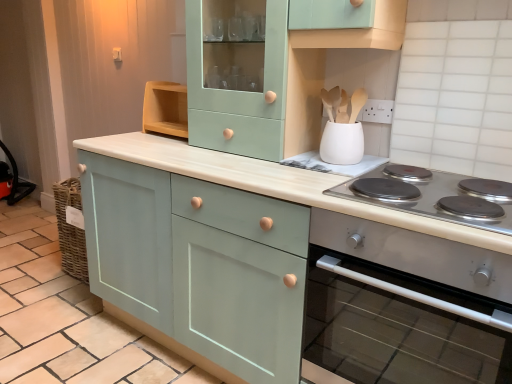
Question: Is matte teal cabinet at center, arranged as the 3th cabinetry when viewed from the right, not inside silver metallic cooktop at lower right?

Choices:
 (A) yes
 (B) no

Answer: (A)

Question: From the image's perspective, is matte teal cabinet at center, arranged as the 3th cabinetry when viewed from the right, over silver metallic cooktop at lower right?

Choices:
 (A) yes
 (B) no

Answer: (B)

Question: From a real-world perspective, is matte teal cabinet at center, arranged as the 3th cabinetry when viewed from the right, on silver metallic cooktop at lower right?

Choices:
 (A) no
 (B) yes

Answer: (A)

Question: Is matte teal cabinet at center, arranged as the 3th cabinetry when viewed from the right, bigger than silver metallic cooktop at lower right?

Choices:
 (A) no
 (B) yes

Answer: (B)

Question: Does matte teal cabinet at center, arranged as the 3th cabinetry when viewed from the right, have a smaller size compared to silver metallic cooktop at lower right?

Choices:
 (A) yes
 (B) no

Answer: (B)

Question: From a real-world perspective, is matte teal cabinet at center, arranged as the 3th cabinetry when viewed from the right, below silver metallic cooktop at lower right?

Choices:
 (A) no
 (B) yes

Answer: (B)

Question: Considering the relative sizes of mint green wood cabinet at upper center, acting as the 2th cabinetry starting from the left, and matte green cabinet at center, which is the 3th cabinetry from left to right, in the image provided, is mint green wood cabinet at upper center, acting as the 2th cabinetry starting from the left, smaller than matte green cabinet at center, which is the 3th cabinetry from left to right,?

Choices:
 (A) no
 (B) yes

Answer: (B)

Question: Is mint green wood cabinet at upper center, acting as the 2th cabinetry starting from the left, positioned with its back to matte green cabinet at center, acting as the 1th cabinetry starting from the right?

Choices:
 (A) yes
 (B) no

Answer: (B)

Question: From a real-world perspective, is mint green wood cabinet at upper center, which appears as the second cabinetry when viewed from the right, below matte green cabinet at center, which is the 3th cabinetry from left to right?

Choices:
 (A) no
 (B) yes

Answer: (A)

Question: Considering the relative sizes of mint green wood cabinet at upper center, which appears as the second cabinetry when viewed from the right, and matte green cabinet at center, which is the 3th cabinetry from left to right, in the image provided, is mint green wood cabinet at upper center, which appears as the second cabinetry when viewed from the right, wider than matte green cabinet at center, which is the 3th cabinetry from left to right,?

Choices:
 (A) yes
 (B) no

Answer: (B)

Question: Is matte green cabinet at center, acting as the 1th cabinetry starting from the right, surrounded by mint green wood cabinet at upper center, which appears as the second cabinetry when viewed from the right?

Choices:
 (A) yes
 (B) no

Answer: (B)

Question: Considering the relative sizes of mint green wood cabinet at upper center, acting as the 2th cabinetry starting from the left, and matte green cabinet at center, acting as the 1th cabinetry starting from the right, in the image provided, is mint green wood cabinet at upper center, acting as the 2th cabinetry starting from the left, bigger than matte green cabinet at center, acting as the 1th cabinetry starting from the right,?

Choices:
 (A) yes
 (B) no

Answer: (B)

Question: From a real-world perspective, is white matte utensil holder at upper center located higher than silver metallic cooktop at lower right?

Choices:
 (A) no
 (B) yes

Answer: (B)